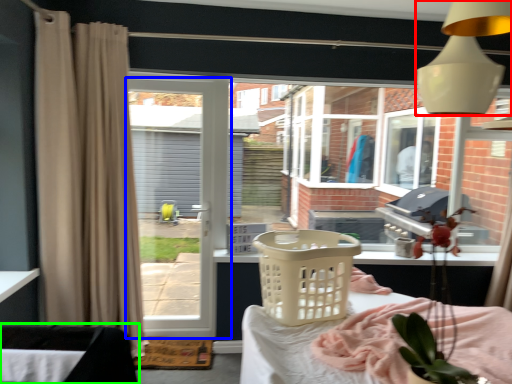
Question: Estimate the real-world distances between objects in this image. Which object is closer to light fixture (highlighted by a red box), door (highlighted by a blue box) or furniture (highlighted by a green box)?

Choices:
 (A) door
 (B) furniture

Answer: (B)